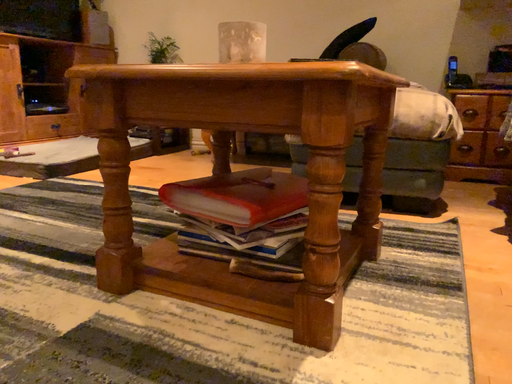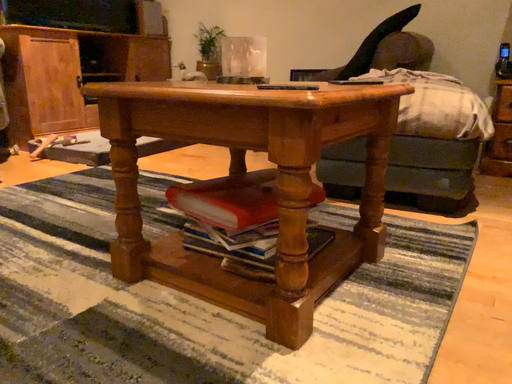
Question: How did the camera likely rotate when shooting the video?

Choices:
 (A) rotated right
 (B) rotated left

Answer: (B)